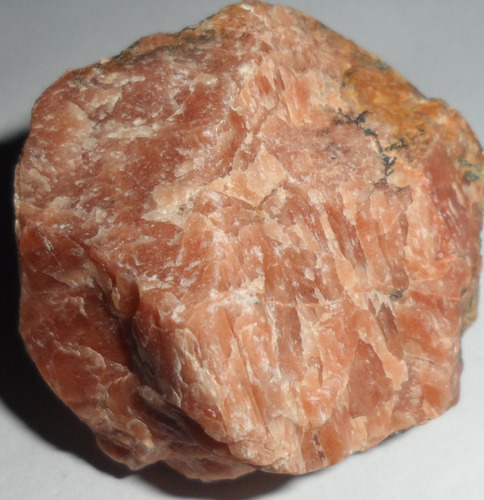
Where is `white table`? The width and height of the screenshot is (484, 500). white table is located at coordinates (363, 468).